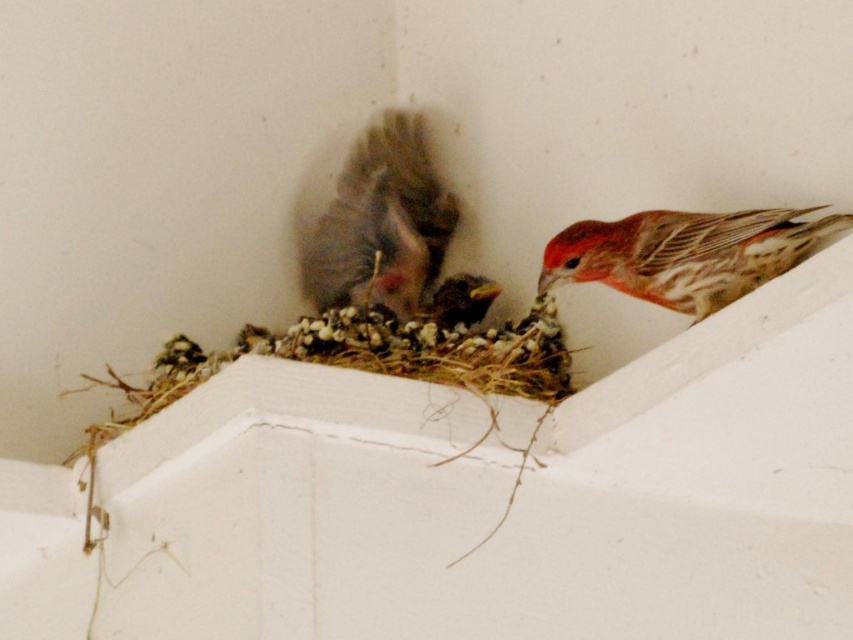
You are a photographer taking a picture of the birdhouse. You notice two points marked in the image. One is at coordinate point (x=373, y=289) and the other at point (x=802, y=237). Which point is closer to your camera?

Point (x=373, y=289) is closer to the camera than point (x=802, y=237).

In the scene shown: You are a birdwatcher trying to locate the gray fluffy sparrow at center in the image. What are the coordinates where you should focus your binoculars?

The gray fluffy sparrow at center is located at coordinates point (381,221).

Consider the image. You are a photographer trying to capture a closeup of the gray fluffy sparrow at center. You have a camera with a zoom lens. The focus point of your camera is currently set at point (381,221). Is the focus point correctly positioned to capture the gray fluffy sparrow at center?

The focus point at (381,221) is on the gray fluffy sparrow at center, so yes, the focus point is correctly positioned to capture the gray fluffy sparrow at center.